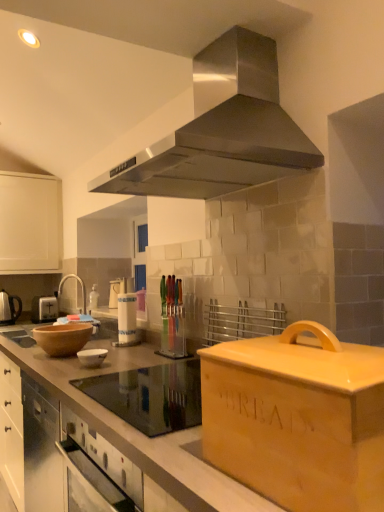
Question: Is white glossy sink at left bigger or smaller than white glossy bowl at center?

Choices:
 (A) big
 (B) small

Answer: (A)

Question: Is white glossy sink at left wider or thinner than white glossy bowl at center?

Choices:
 (A) thin
 (B) wide

Answer: (B)

Question: Estimate the real-world distances between objects in this image. Which object is farther from the matte brown countertop at center, which ranks as the second countertop in back-to-front order?

Choices:
 (A) brown matte wood at center, which appears as the second countertop when viewed from the front
 (B) white glossy bowl at center
 (C) matte black kettle at left
 (D) white plastic toaster at left
 (E) stainless steel range hood at upper center

Answer: (C)

Question: Which is nearer to the white plastic toaster at left?

Choices:
 (A) stainless steel range hood at upper center
 (B) white glossy bowl at center
 (C) brown matte wood at center, which appears as the second countertop when viewed from the front
 (D) matte black kettle at left
 (E) matte brown countertop at center, which is counted as the 1th countertop, starting from the front

Answer: (D)